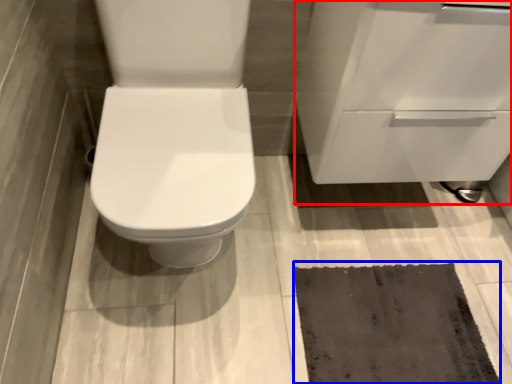
Question: Which point is further to the camera, cabinetry (highlighted by a red box) or doormat (highlighted by a blue box)?

Choices:
 (A) cabinetry
 (B) doormat

Answer: (B)